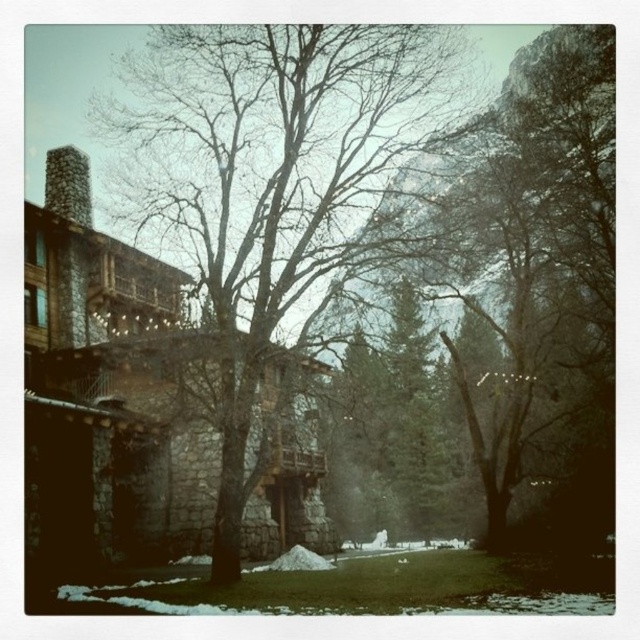
Question: Which of the following is the closest to the observer?

Choices:
 (A) (124, 120)
 (B) (52, 180)

Answer: (B)

Question: Which point is farther from the camera taking this photo?

Choices:
 (A) (84, 212)
 (B) (358, 147)

Answer: (A)

Question: Is the position of bare wood tree at center less distant than that of stone chimney at left?

Choices:
 (A) yes
 (B) no

Answer: (A)

Question: Among these points, which one is nearest to the camera?

Choices:
 (A) (81, 173)
 (B) (145, 172)

Answer: (A)

Question: Can you confirm if bare wood tree at center is positioned above stone chimney at left?

Choices:
 (A) no
 (B) yes

Answer: (B)

Question: Can you confirm if bare wood tree at center is bigger than stone chimney at left?

Choices:
 (A) yes
 (B) no

Answer: (A)